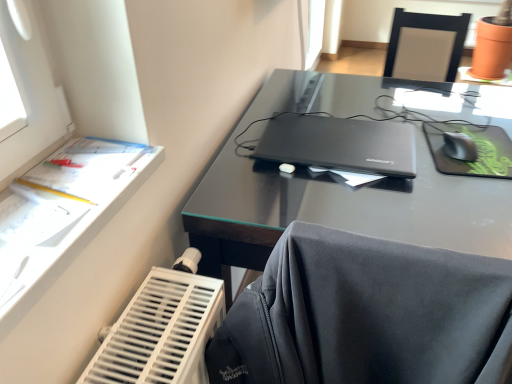
In order to click on free space that is in between matte black laptop at center and black matte mouse pad at right in this screenshot , I will do `click(428, 151)`.